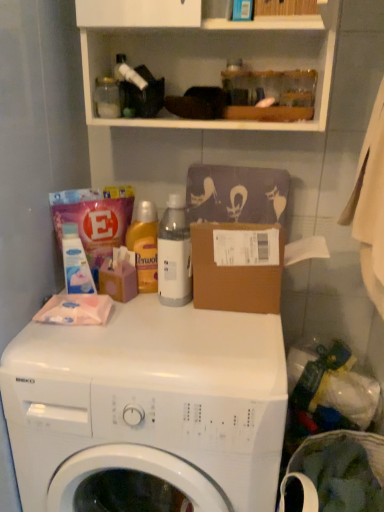
The height and width of the screenshot is (512, 384). What are the coordinates of `free point in front of translucent plastic bottle at center` in the screenshot? It's located at tap(149, 320).